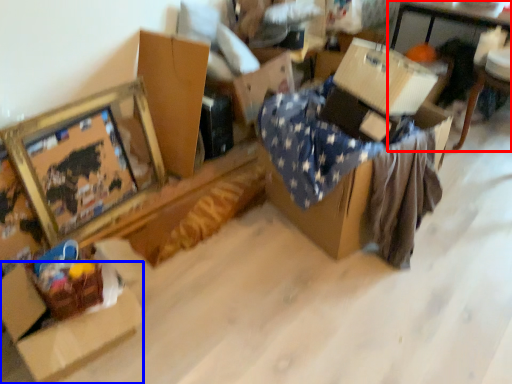
Question: Which object appears farthest to the camera in this image, table (highlighted by a red box) or cardboard box (highlighted by a blue box)?

Choices:
 (A) table
 (B) cardboard box

Answer: (A)